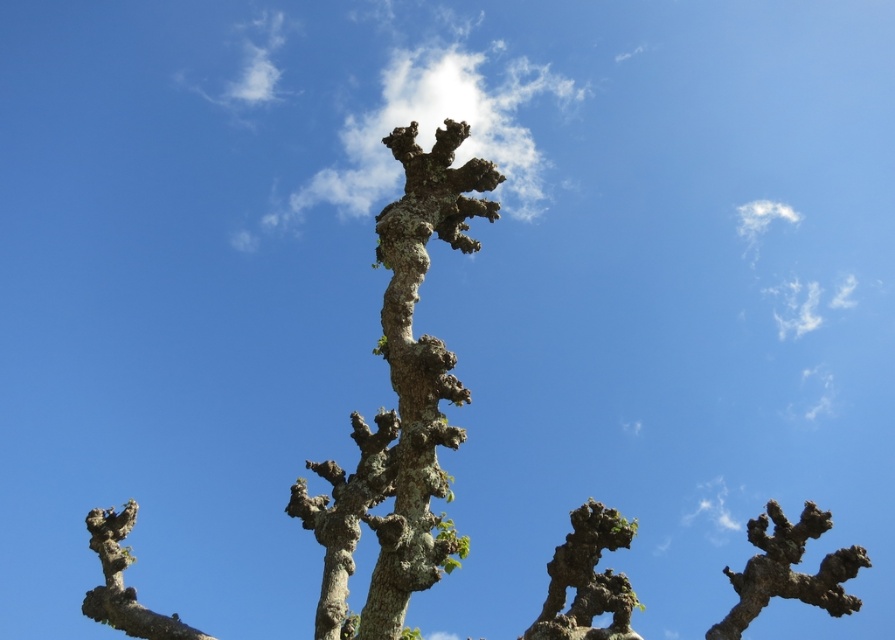
You are standing in front of the tree and notice two points marked on its branches. The first point is located at coordinates point [425,225] and the second at point [829,556]. Which point is closer to you?

Point [425,225] is in front of point [829,556], so the first point is closer to you.